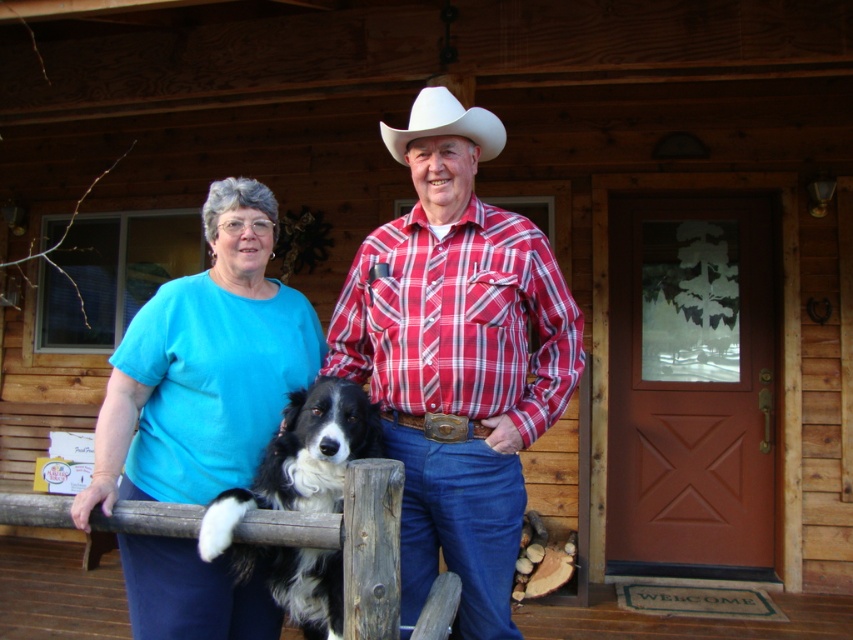
You are standing at the entrance of the wooden cabin and want to take a photo of the red plaid shirt at center. Where should you position yourself to capture it in the frame?

To capture the red plaid shirt at center in the frame, position yourself at the entrance of the wooden cabin since the red plaid shirt at center is located at point (457, 356), which is near the center of the image.

Looking at this image, you are a photographer trying to capture a clear photo of both the red plaid shirt at center and the black and white fur at center. Since the camera can only focus on one subject at a time, which object should you choose to ensure the smaller one is in focus?

The black and white fur at center is smaller than the red plaid shirt at center, so you should focus on the black and white fur at center to ensure it is in focus.

You are standing on the porch of the wooden cabin and want to touch the point at coordinates (204, 368). Which object will your hand come into contact with?

The point at coordinates (204, 368) is on the matte blue shirt at center, so your hand will come into contact with the matte blue shirt at center.